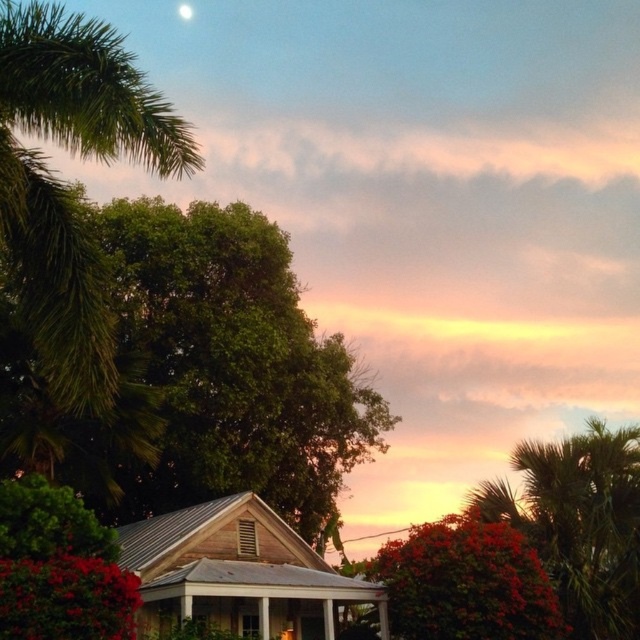
You are standing in the middle of a forest clearing and see the green leafy tree at upper left and the white glossy moon at upper center. Which object is closer to you?

The green leafy tree at upper left is closer to you because it is only 143.71 feet away from the white glossy moon at upper center, but since the moon is much farther away in reality, the tree is the closer object.

You are an astronomer observing the sky and notice the green leafy tree at upper left and the white glossy moon at upper center. Which object appears closer to you from your observation point?

The green leafy tree at upper left appears closer to you because it is positioned in front of the white glossy moon at upper center.